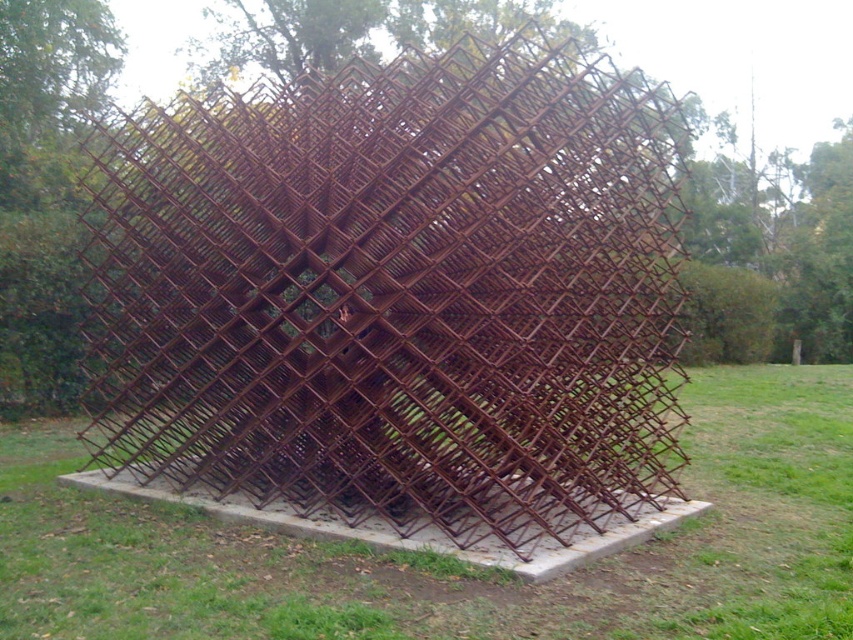
Can you confirm if rusty metal cage at center is shorter than rusty metal structure at center?

No.

Is point (112, 212) positioned behind point (822, 426)?

That is False.

Find the location of a particular element. This screenshot has height=640, width=853. rusty metal cage at center is located at coordinates (396, 298).